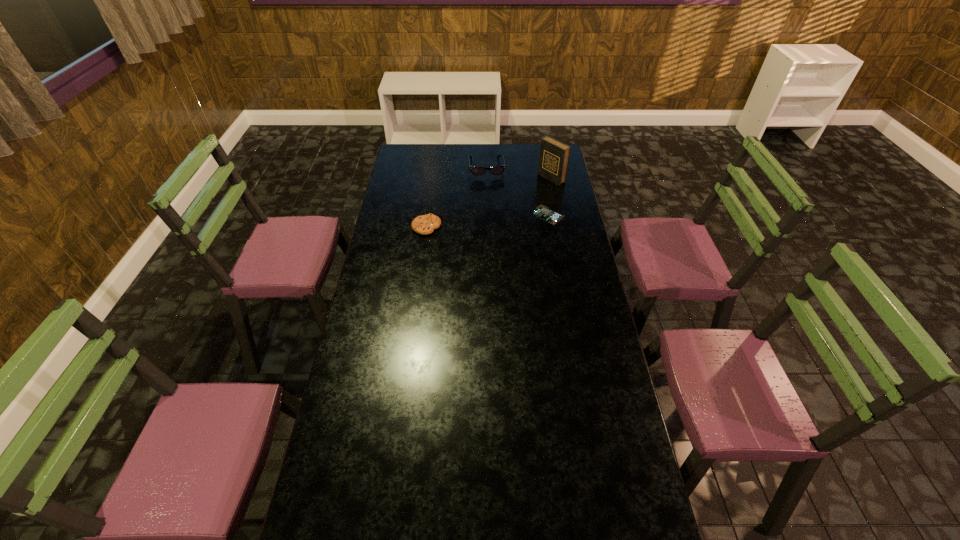
Where is `free space that satisfies the following two spatial constraints: 1. on the front side of the tallest object; 2. on the right side of the second object from left to right`? The image size is (960, 540). free space that satisfies the following two spatial constraints: 1. on the front side of the tallest object; 2. on the right side of the second object from left to right is located at coordinates (487, 179).

Locate an element on the screen. This screenshot has height=540, width=960. vacant point that satisfies the following two spatial constraints: 1. on the back side of the leftmost object; 2. on the left side of the diary is located at coordinates (433, 179).

At what (x,y) coordinates should I click in order to perform the action: click on free space that satisfies the following two spatial constraints: 1. on the back side of the shortest object; 2. on the left side of the cookie. Please return your answer as a coordinate pair (x, y). Image resolution: width=960 pixels, height=540 pixels. Looking at the image, I should click on (428, 215).